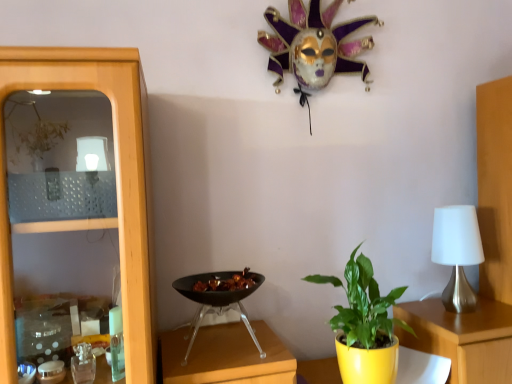
Question: From their relative heights in the image, would you say black glossy wok at center is taller or shorter than satin silver table lamp at right?

Choices:
 (A) short
 (B) tall

Answer: (A)

Question: Is black glossy wok at center wider or thinner than satin silver table lamp at right?

Choices:
 (A) thin
 (B) wide

Answer: (B)

Question: Estimate the real-world distances between objects in this image. Which object is closer to the satin silver table lamp at right?

Choices:
 (A) black glossy wok at center
 (B) green glossy leafy plant at center

Answer: (B)

Question: Considering the real-world distances, which object is farthest from the green glossy leafy plant at center?

Choices:
 (A) black glossy wok at center
 (B) satin silver table lamp at right

Answer: (B)